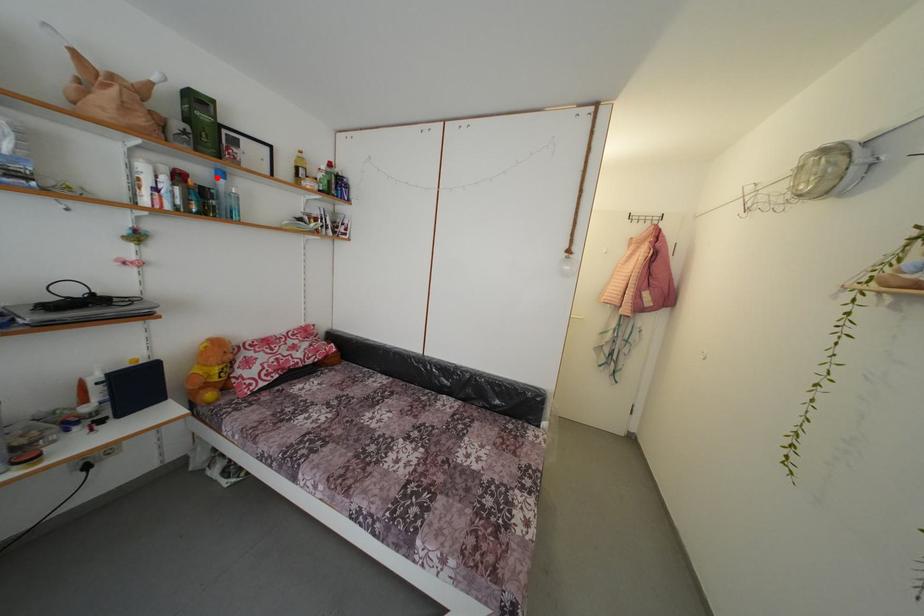
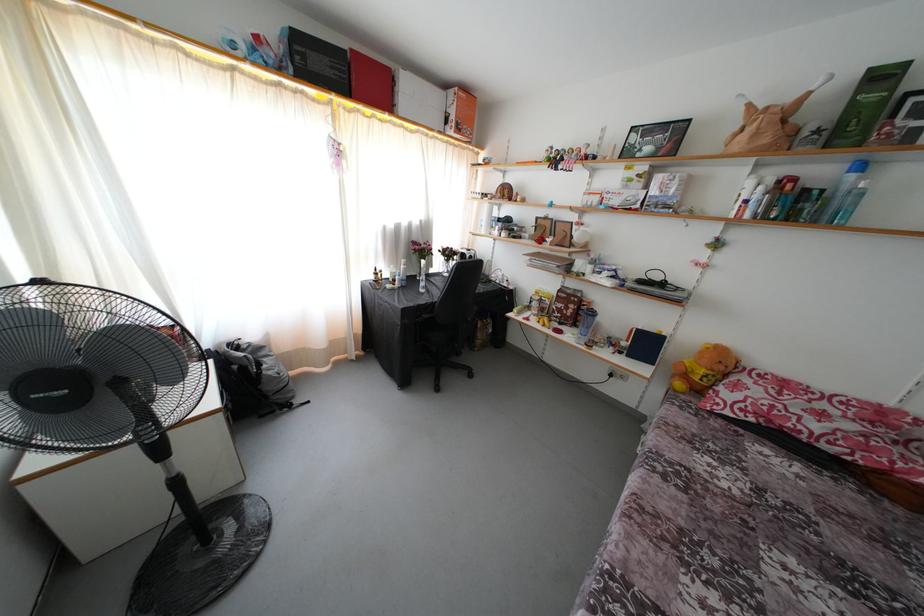
Question: I am providing you with two images of the same scene from different viewpoints. Given a red point in image1, look at the same physical point in image2. Is it:

Choices:
 (A) Closer to the viewpoint
 (B) Farther from the viewpoint

Answer: (B)